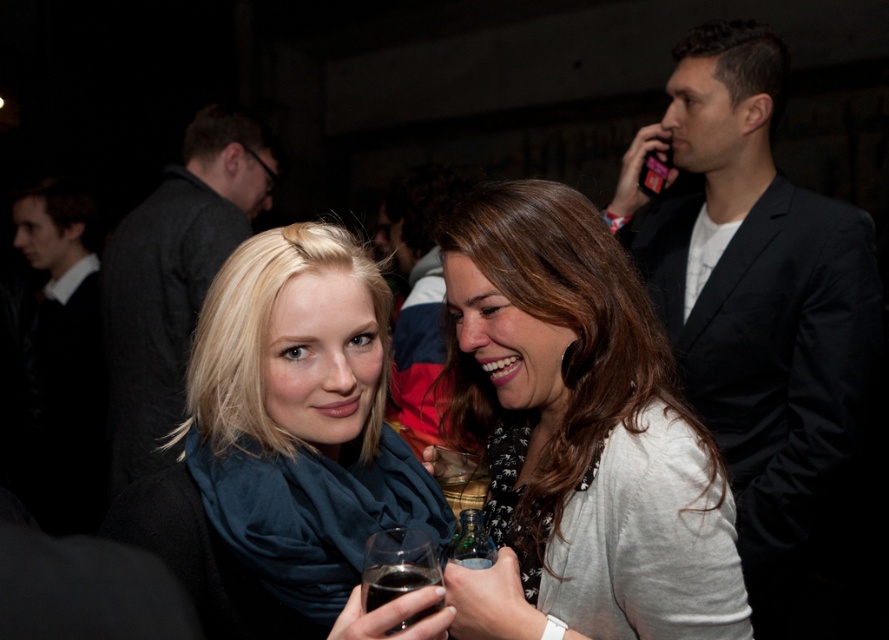
You are standing in the middle of the room and see two points marked in the image. Which point, point (446, 506) or point (483, 552), is closer to you?

Point (446, 506) is closer to you because it is further to the viewer than point (483, 552).

You are at a party and want to approach the person wearing the matte white sweater at center. Which direction should you move relative to the black suit jacket at upper right?

To reach the matte white sweater at center, you should move to the left of the black suit jacket at upper right since the matte white sweater at center is positioned to the left of it.

You are at a party and want to place a small gift on the table where the dark glass at lower center is located. However, there is a dark suit jacket at center already on the table. Can you place the gift between them without moving either item?

The dark suit jacket at center is above the dark glass at lower center, meaning they are stacked rather than side by side. Therefore, there is no space between them to place the gift.